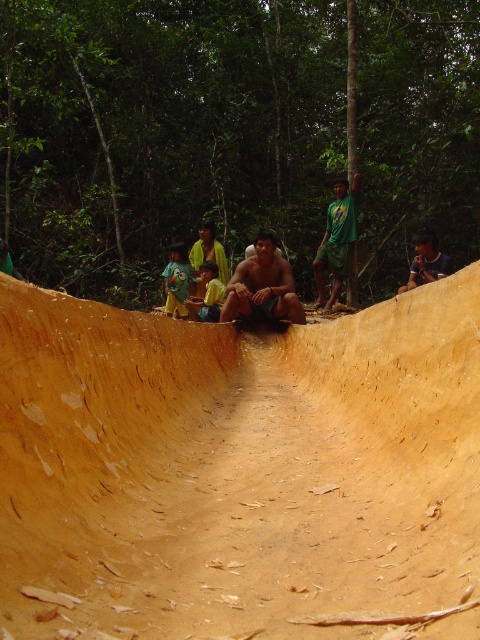
Between green t-shirt at center and yellow shirt at center, which one has less height?

With less height is yellow shirt at center.

Can you confirm if green t-shirt at center is positioned to the left of yellow shirt at center?

Yes, green t-shirt at center is to the left of yellow shirt at center.

Is point (179, 252) positioned after point (215, 285)?

Yes, it is.

Find the location of a particular element. Image resolution: width=480 pixels, height=640 pixels. green t-shirt at center is located at coordinates (178, 280).

Does point (419, 396) lie in front of point (202, 317)?

Yes, it is.

Find the location of a particular element. brown rough wood at center is located at coordinates (238, 468).

Which is in front, point (358, 467) or point (214, 284)?

Point (358, 467) is in front.

You are a GUI agent. You are given a task and a screenshot of the screen. Output one action in this format:
    pyautogui.click(x=<x>, y=<y>)
    Task: Click on the brown rough wood at center
    This screenshot has width=480, height=640.
    Given the screenshot: What is the action you would take?
    pyautogui.click(x=238, y=468)

Is point (364, 420) positioned before point (272, 266)?

Yes, it is.

Is brown rough wood at center thinner than brown wood man at center?

Incorrect, brown rough wood at center's width is not less than brown wood man at center's.

Who is more forward, (214, 586) or (284, 285)?

Positioned in front is point (214, 586).

The image size is (480, 640). Find the location of `brown rough wood at center`. brown rough wood at center is located at coordinates (238, 468).